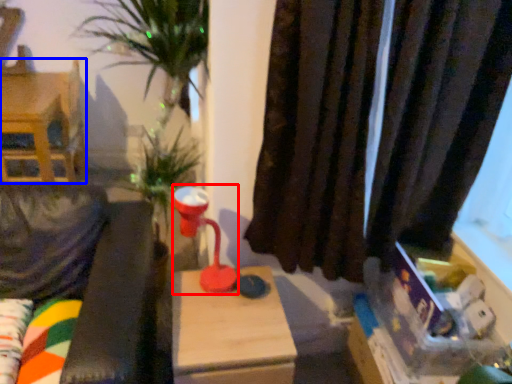
Question: Which object appears closest to the camera in this image, table lamp (highlighted by a red box) or furniture (highlighted by a blue box)?

Choices:
 (A) table lamp
 (B) furniture

Answer: (A)